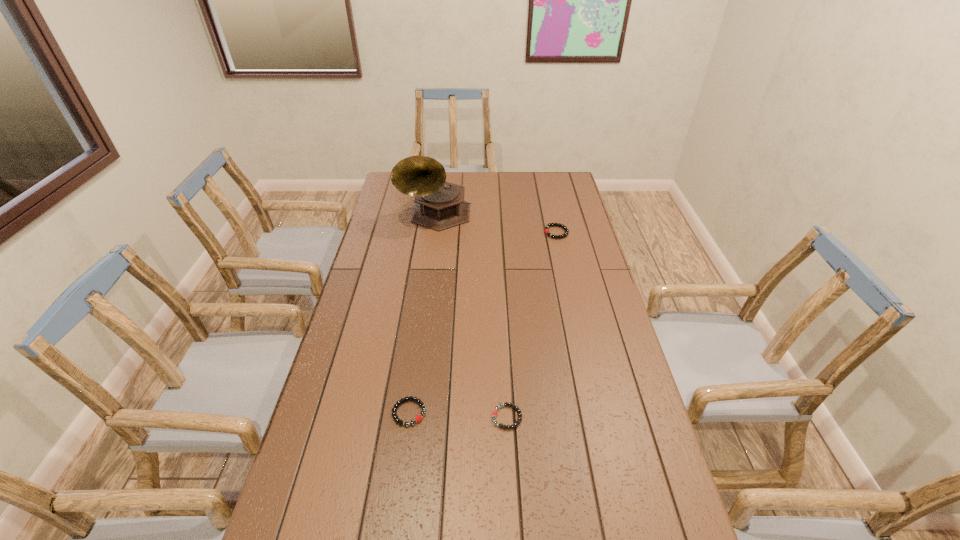
The image size is (960, 540). Find the location of `object that is at the left edge`. object that is at the left edge is located at coordinates (439, 205).

Image resolution: width=960 pixels, height=540 pixels. Find the location of `object positioned at the right edge`. object positioned at the right edge is located at coordinates (548, 225).

Identify the location of object present at the far left corner. (439, 205).

Find the location of a particular element. vacant space at the far edge of the desktop is located at coordinates (505, 192).

Find the location of `vacant area at the left edge`. vacant area at the left edge is located at coordinates (376, 393).

The height and width of the screenshot is (540, 960). I want to click on free space at the right edge, so click(x=619, y=459).

This screenshot has height=540, width=960. In order to click on empty location between the rightmost object and the second object from right to left in this screenshot , I will do pyautogui.click(x=532, y=325).

Identify the location of free space between the leftmost bracelet and the tallest object. (422, 314).

The width and height of the screenshot is (960, 540). Find the location of `vacant region between the rightmost object and the leftmost bracelet`. vacant region between the rightmost object and the leftmost bracelet is located at coordinates (483, 322).

In order to click on free space between the second object from right to left and the phonograph record in this screenshot , I will do `click(471, 316)`.